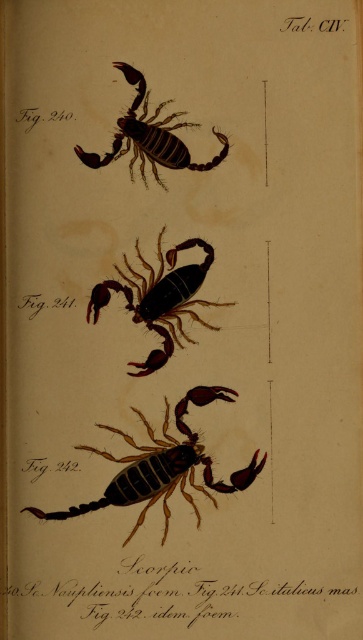
From the picture: Does brown textured scorpion at lower center appear under shiny brown scorpion at center?

Correct, brown textured scorpion at lower center is located below shiny brown scorpion at center.

Which of these two, brown textured scorpion at lower center or shiny brown scorpion at center, stands taller?

brown textured scorpion at lower center

At what (x,y) coordinates should I click in order to perform the action: click on brown textured scorpion at lower center. Please return your answer as a coordinate pair (x, y). The width and height of the screenshot is (363, 640). Looking at the image, I should click on (162, 467).

Based on the photo, who is positioned more to the right, brown textured scorpion at lower center or brown matte scorpion at upper center?

brown matte scorpion at upper center is more to the right.

Is brown textured scorpion at lower center to the right of brown matte scorpion at upper center from the viewer's perspective?

No, brown textured scorpion at lower center is not to the right of brown matte scorpion at upper center.

Is point (35, 512) positioned after point (226, 141)?

That is False.

At what (x,y) coordinates should I click in order to perform the action: click on brown textured scorpion at lower center. Please return your answer as a coordinate pair (x, y). Looking at the image, I should click on tap(162, 467).

Which is behind, point (173, 300) or point (135, 161)?

The point (173, 300) is more distant.

Which of these two, shiny brown scorpion at center or brown matte scorpion at upper center, stands shorter?

brown matte scorpion at upper center is shorter.

Identify the location of shiny brown scorpion at center. The image size is (363, 640). click(x=160, y=298).